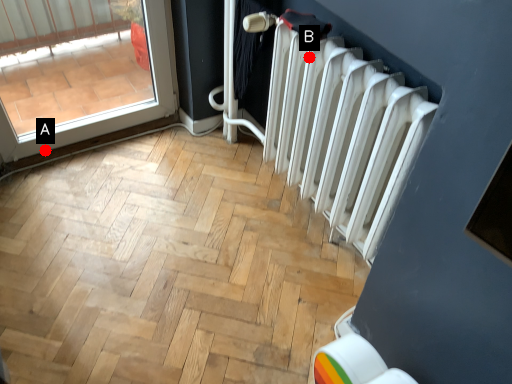
Question: Two points are circled on the image, labeled by A and B beside each circle. Which point is closer to the camera taking this photo?

Choices:
 (A) A is closer
 (B) B is closer

Answer: (B)